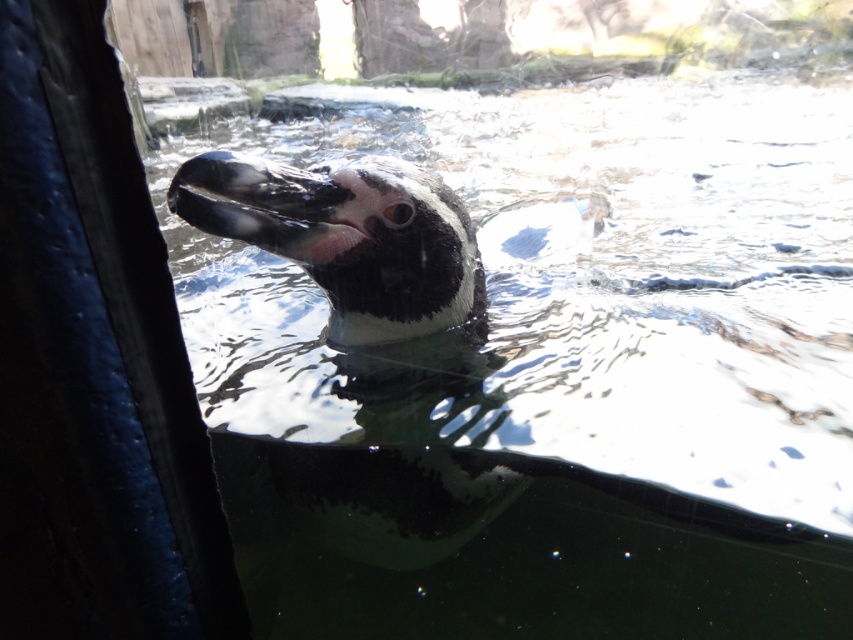
Can you confirm if clear water at center is smaller than black matte penguin at center?

Actually, clear water at center might be larger than black matte penguin at center.

Can you confirm if clear water at center is positioned above black matte penguin at center?

Yes.

Who is more distant from viewer, [305,486] or [318,173]?

Point [305,486]

The width and height of the screenshot is (853, 640). In order to click on clear water at center in this screenshot , I will do `click(553, 378)`.